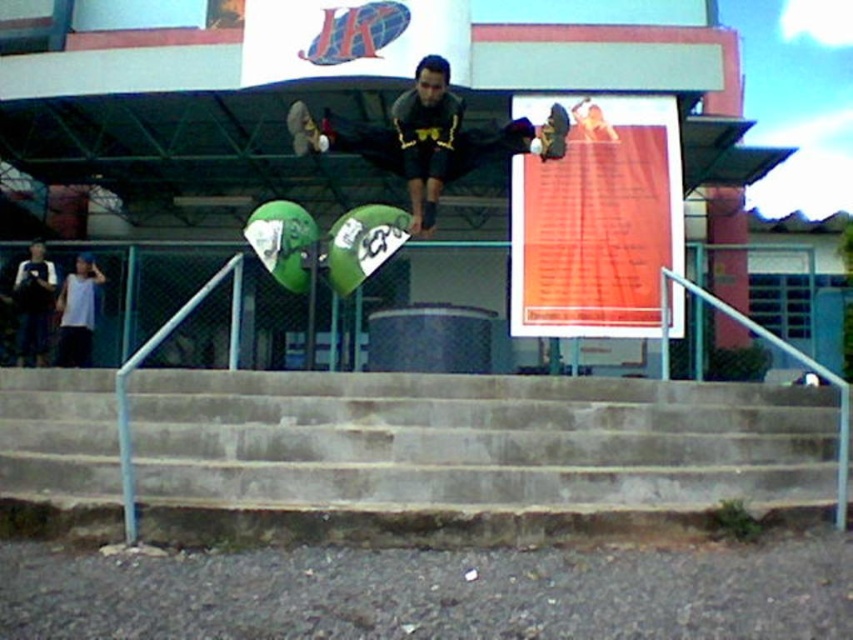
Question: Is matte black skateboard at center closer to camera compared to green matte skateboard at center?

Choices:
 (A) yes
 (B) no

Answer: (A)

Question: Among these objects, which one is farthest from the camera?

Choices:
 (A) concrete stairs at center
 (B) green matte skateboard at center

Answer: (B)

Question: Considering the real-world distances, which object is closest to the concrete stairs at center?

Choices:
 (A) green matte skateboard at center
 (B) matte black skateboard at center

Answer: (B)

Question: Which of these objects is positioned farthest from the concrete stairs at center?

Choices:
 (A) green matte skateboard at center
 (B) matte black skateboard at center

Answer: (A)

Question: In this image, where is matte black skateboard at center located relative to green matte skateboard at center?

Choices:
 (A) right
 (B) left

Answer: (B)

Question: Can you confirm if concrete stairs at center is thinner than green matte skateboard at center?

Choices:
 (A) yes
 (B) no

Answer: (B)